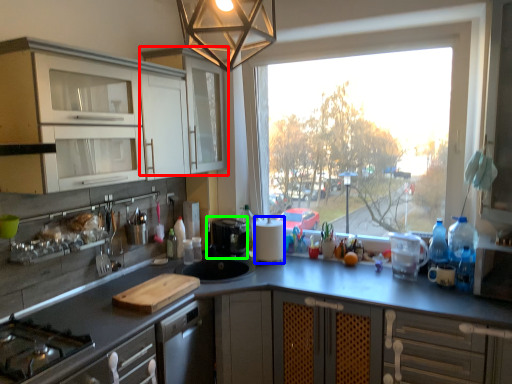
Question: Which object is positioned farthest from cabinetry (highlighted by a red box)? Select from paper towel (highlighted by a blue box) and coffee machine (highlighted by a green box).

Choices:
 (A) paper towel
 (B) coffee machine

Answer: (A)